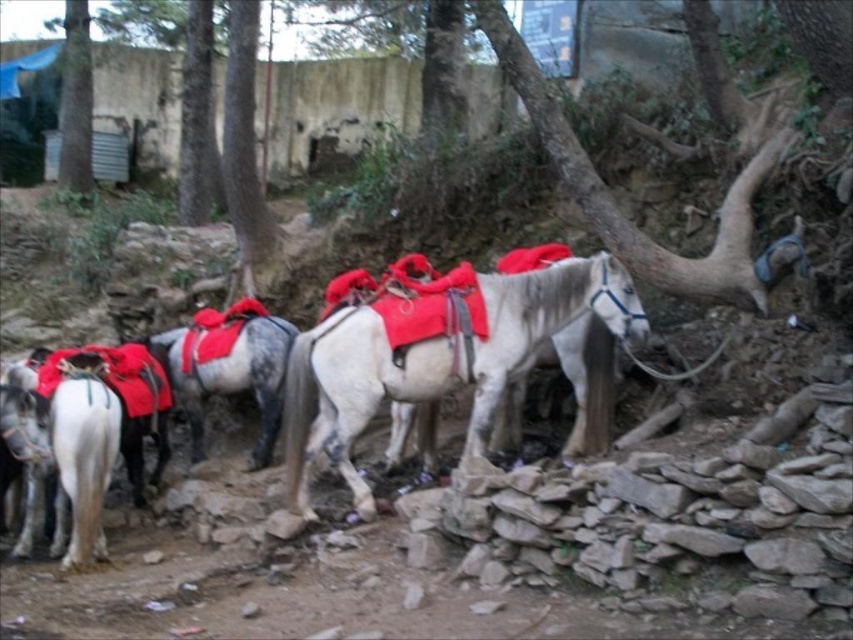
Who is positioned more to the left, white matte horse at center or white glossy horse at left?

white glossy horse at left

I want to click on white matte horse at center, so click(x=434, y=358).

Is white matte horse at center wider than green rough bark tree at upper center?

Yes, white matte horse at center is wider than green rough bark tree at upper center.

Can you confirm if white matte horse at center is positioned to the left of green rough bark tree at upper center?

No, white matte horse at center is not to the left of green rough bark tree at upper center.

In order to click on white matte horse at center in this screenshot , I will do `click(434, 358)`.

Identify the location of brown rough tree at upper center. (242, 138).

Is point (230, 118) positioned before point (195, 1)?

Yes.

Image resolution: width=853 pixels, height=640 pixels. I want to click on brown rough tree at upper center, so point(242,138).